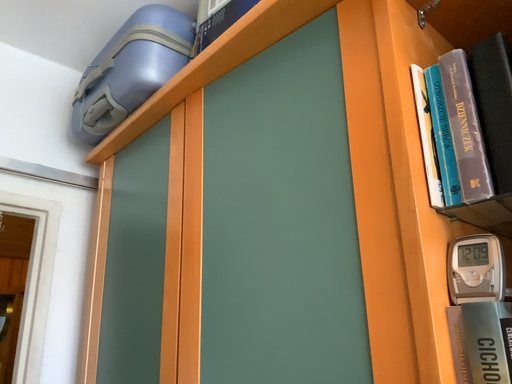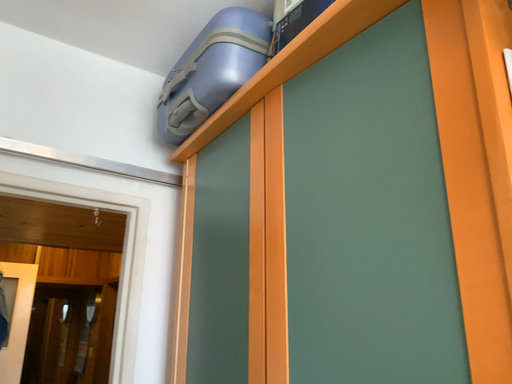
Question: Which way did the camera rotate in the video?

Choices:
 (A) rotated right
 (B) rotated left

Answer: (B)